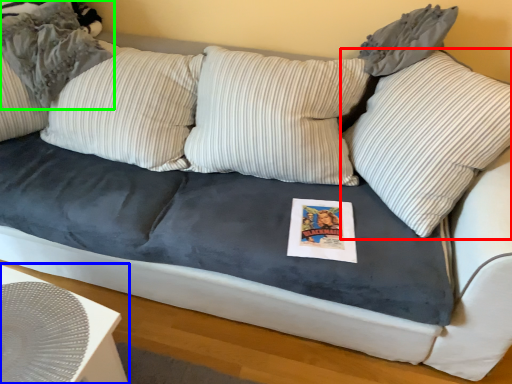
Question: Which object is positioned closest to pillow (highlighted by a red box)? Select from table (highlighted by a blue box) and pillow (highlighted by a green box).

Choices:
 (A) table
 (B) pillow

Answer: (A)